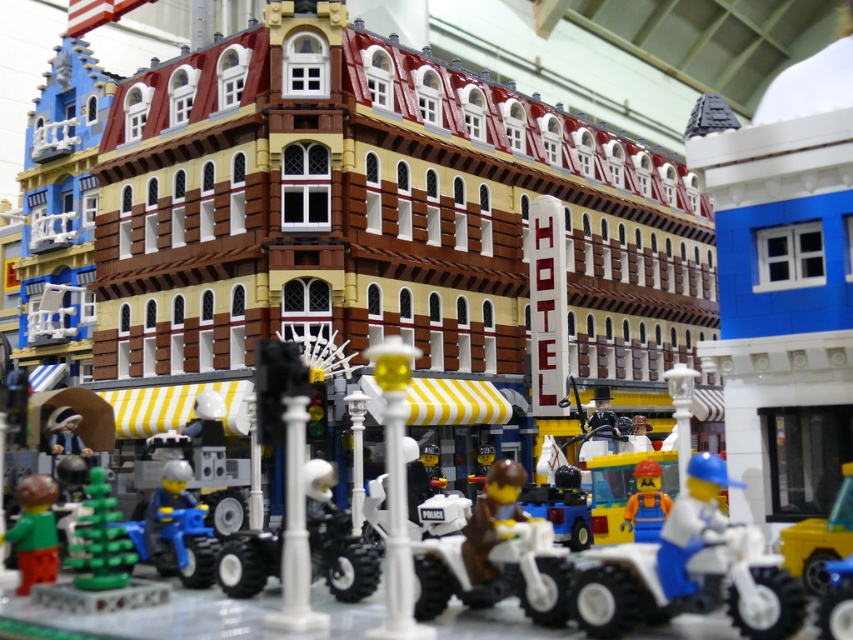
Does white matte police motorcycle at center come in front of green matte figure at lower left?

Yes, it is.

Can you confirm if white matte police motorcycle at center is positioned to the left of green matte figure at lower left?

No, white matte police motorcycle at center is not to the left of green matte figure at lower left.

At what (x,y) coordinates should I click in order to perform the action: click on white matte police motorcycle at center. Please return your answer as a coordinate pair (x, y). Looking at the image, I should click on (495, 556).

Who is shorter, green matte christmas tree at lower left or blue plastic figure at center?

With less height is blue plastic figure at center.

Is point (115, 538) positioned in front of point (648, 477)?

That is True.

Locate an element on the screen. The image size is (853, 640). green matte christmas tree at lower left is located at coordinates (102, 540).

Does white matte police motorcycle at center have a greater height compared to blue plastic motorcycle at lower left?

Correct, white matte police motorcycle at center is much taller as blue plastic motorcycle at lower left.

Is white matte police motorcycle at center below blue plastic motorcycle at lower left?

Indeed, white matte police motorcycle at center is positioned under blue plastic motorcycle at lower left.

Where is `white matte police motorcycle at center`? white matte police motorcycle at center is located at coordinates (495, 556).

The height and width of the screenshot is (640, 853). Find the location of `white matte police motorcycle at center`. white matte police motorcycle at center is located at coordinates (495, 556).